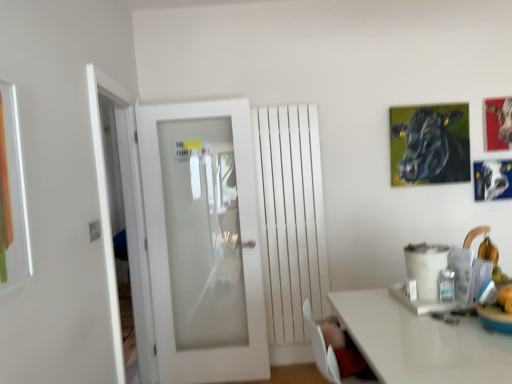
Where is `blank space situated above oil painting cow at upper right, which appears as the third picture frame when viewed from the right (from a real-world perspective)`? blank space situated above oil painting cow at upper right, which appears as the third picture frame when viewed from the right (from a real-world perspective) is located at coordinates (423, 102).